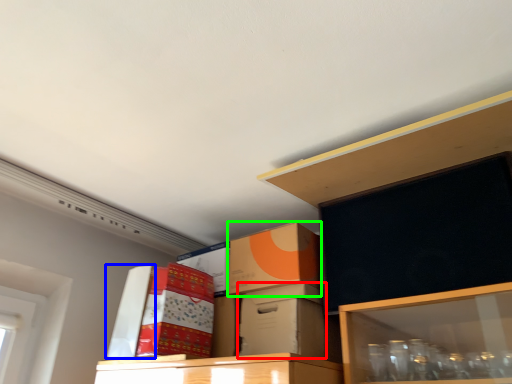
Question: Estimate the real-world distances between objects in this image. Which object is farther from box (highlighted by a red box), box (highlighted by a blue box) or box (highlighted by a green box)?

Choices:
 (A) box
 (B) box

Answer: (A)